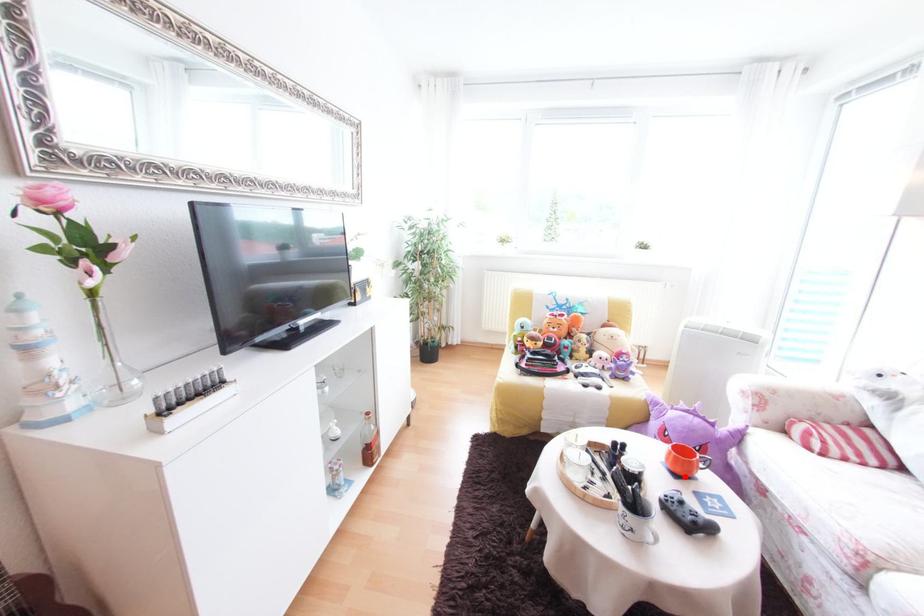
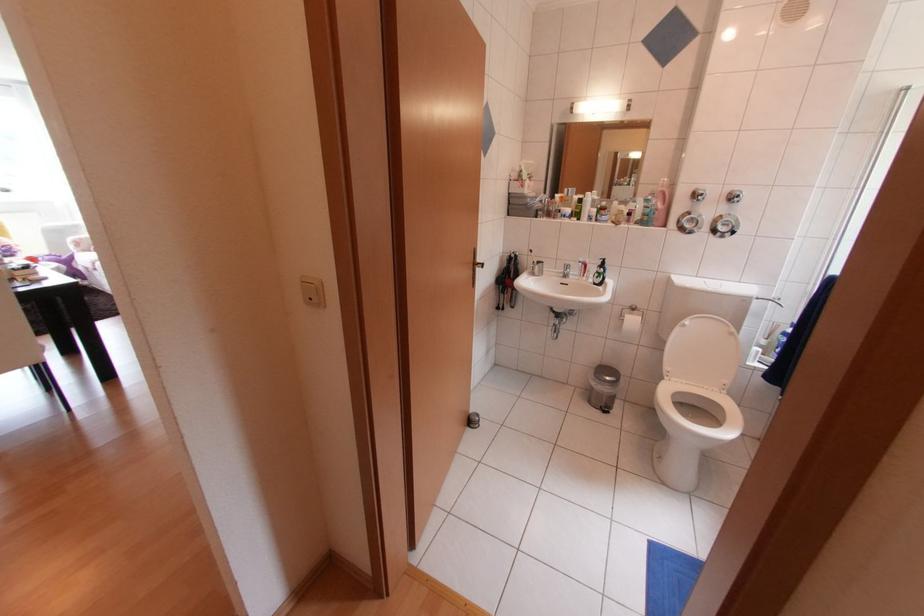
Question: I am providing you with two images of the same scene from different viewpoints. A red point is marked on the first image. Can you still see the location of the red point in image 2?

Choices:
 (A) Yes
 (B) No

Answer: (B)